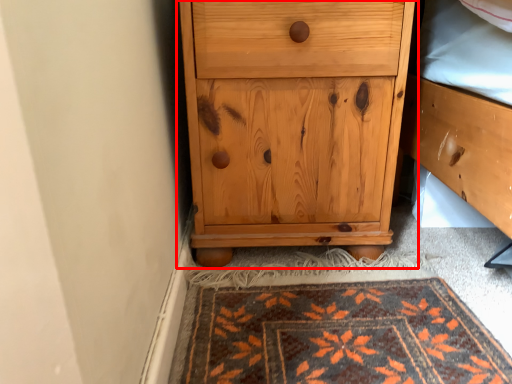
Question: From the image's perspective, where is chest of drawers (annotated by the red box) located relative to mat?

Choices:
 (A) above
 (B) below

Answer: (A)